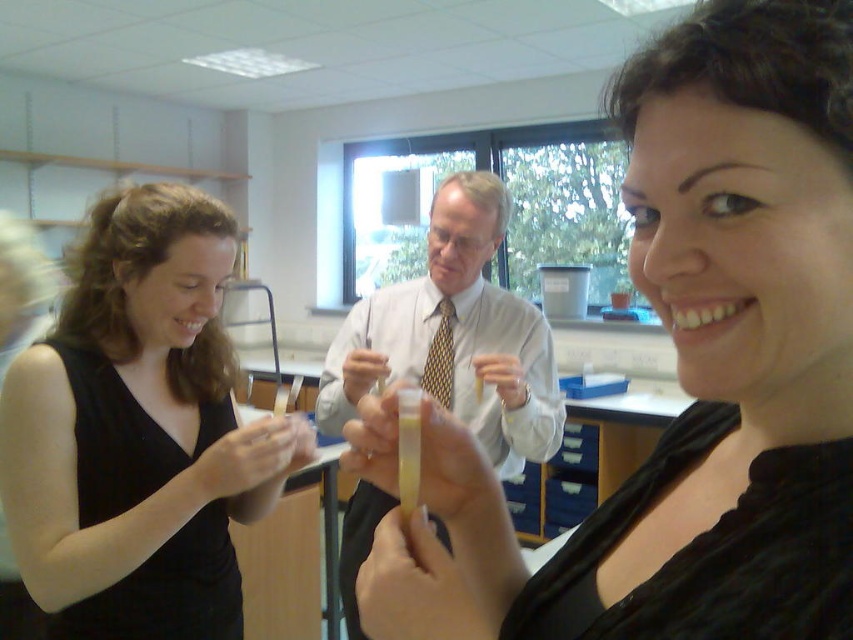
Can you confirm if black matte/soft shirt at center is positioned below white shirt at center?

No, black matte/soft shirt at center is not below white shirt at center.

You are a GUI agent. You are given a task and a screenshot of the screen. Output one action in this format:
    pyautogui.click(x=<x>, y=<y>)
    Task: Click on the black matte/soft shirt at center
    The image size is (853, 640).
    Given the screenshot: What is the action you would take?
    pyautogui.click(x=689, y=371)

Does black matte dress at left lie in front of white shirt at center?

That is True.

Does black matte dress at left have a larger size compared to white shirt at center?

No, black matte dress at left is not bigger than white shirt at center.

Which is in front, point (165, 630) or point (463, 195)?

Point (165, 630)

Identify the location of black matte dress at left. (138, 432).

Who is higher up, black matte/soft shirt at center or black matte dress at left?

black matte/soft shirt at center

Consider the image. Is black matte/soft shirt at center wider than black matte dress at left?

No.

Who is more forward, (473, 624) or (225, 563)?

A: Point (473, 624) is more forward.

Locate an element on the screen. black matte/soft shirt at center is located at coordinates (689, 371).